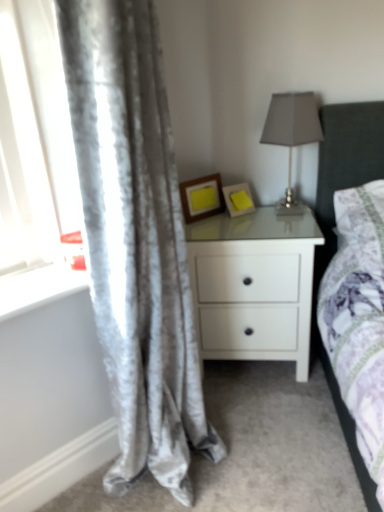
Identify the location of vacant space that is to the left of satin gray lampshade at upper right. (239, 223).